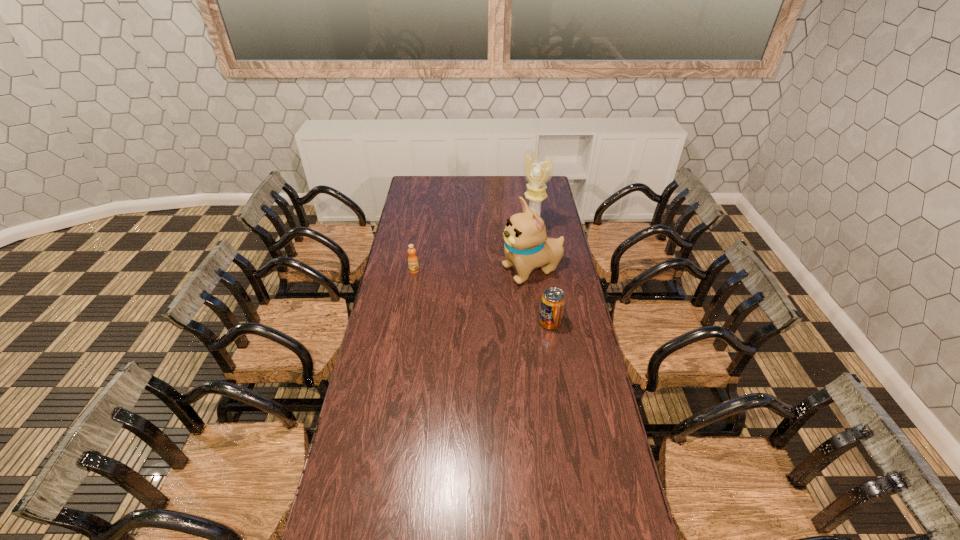
Identify which object is the closest to the puppy. Please provide its 2D coordinates. Your answer should be formatted as a tuple, i.e. [(x, y)], where the tuple contains the x and y coordinates of a point satisfying the conditions above.

[(538, 172)]

Identify which object is located as the nearest to the nearest object. Please provide its 2D coordinates. Your answer should be formatted as a tuple, i.e. [(x, y)], where the tuple contains the x and y coordinates of a point satisfying the conditions above.

[(526, 247)]

The width and height of the screenshot is (960, 540). I want to click on free space that satisfies the following two spatial constraints: 1. on the front label of the puppy; 2. on the left side of the leftmost object, so click(x=414, y=271).

This screenshot has height=540, width=960. Find the location of `vacant space that satisfies the following two spatial constraints: 1. on the back side of the third shortest object; 2. on the left side of the award`. vacant space that satisfies the following two spatial constraints: 1. on the back side of the third shortest object; 2. on the left side of the award is located at coordinates (526, 231).

The width and height of the screenshot is (960, 540). In order to click on vacant region that satisfies the following two spatial constraints: 1. on the front side of the nearest object; 2. on the left side of the third shortest object in this screenshot , I will do `click(540, 322)`.

The width and height of the screenshot is (960, 540). In order to click on free point that satisfies the following two spatial constraints: 1. on the front label of the soda can; 2. on the left side of the orange juice in this screenshot , I will do `click(405, 322)`.

Where is `vacant space that satisfies the following two spatial constraints: 1. on the front label of the puppy; 2. on the left side of the orange juice`? This screenshot has height=540, width=960. vacant space that satisfies the following two spatial constraints: 1. on the front label of the puppy; 2. on the left side of the orange juice is located at coordinates (414, 271).